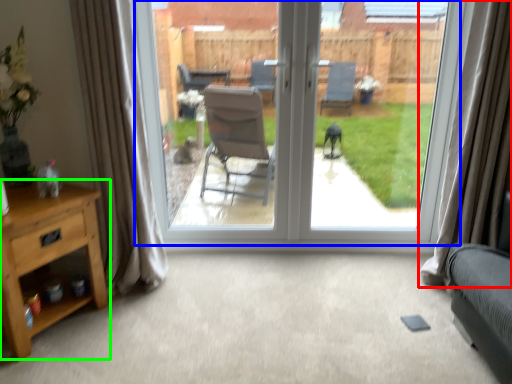
Question: Based on their relative distances, which object is farther from curtain (highlighted by a red box)? Choose from window (highlighted by a blue box) and nightstand (highlighted by a green box).

Choices:
 (A) window
 (B) nightstand

Answer: (B)